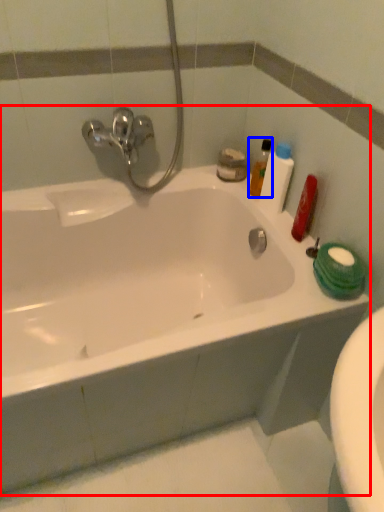
Question: Which object is closer to the camera taking this photo, bathtub (highlighted by a red box) or cleaning product (highlighted by a blue box)?

Choices:
 (A) bathtub
 (B) cleaning product

Answer: (A)